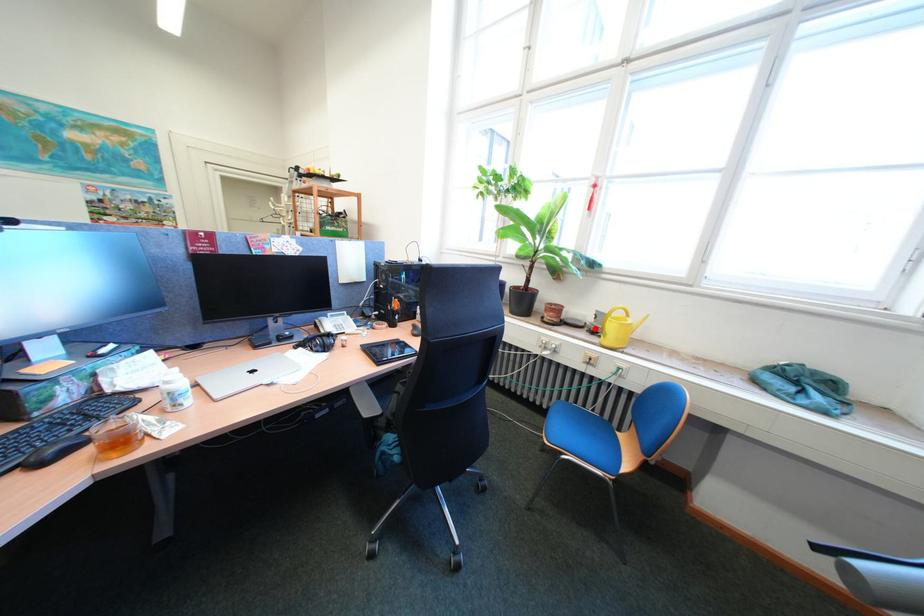
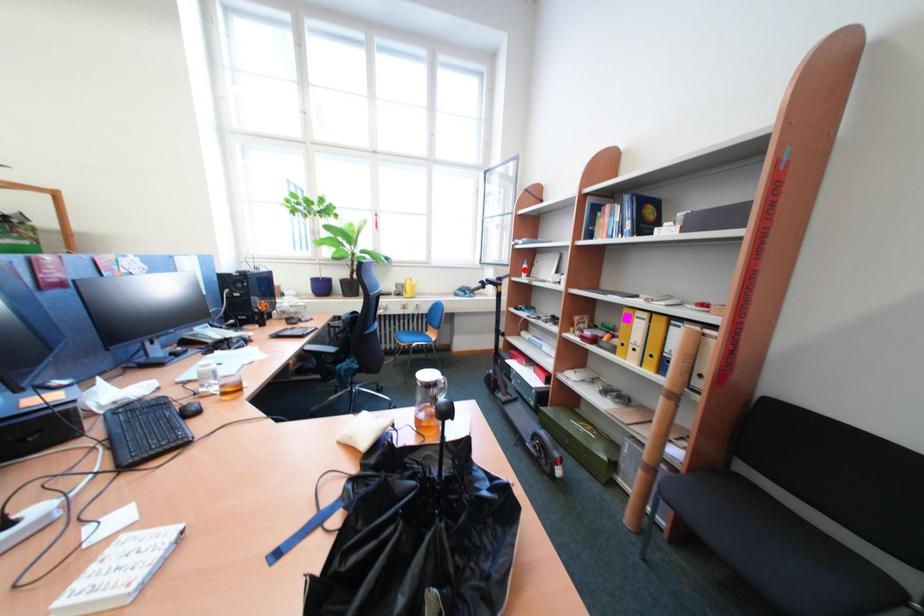
I am providing you with two images of the same scene from different viewpoints. A red point is marked on the first image and another point is marked on the second image. Do the highlighted points in image1 and image2 indicate the same real-world spot?

No